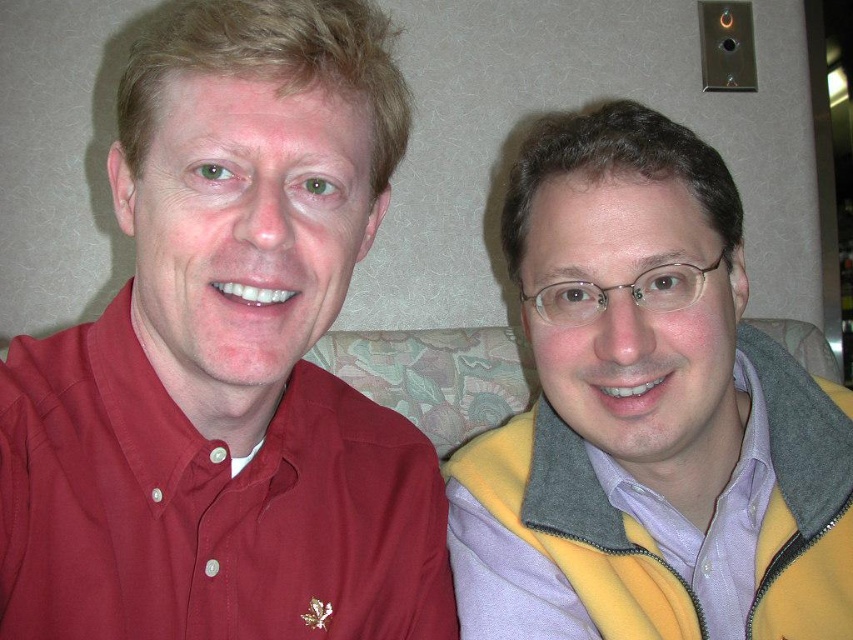
You are designing a new outfit for a character in a video game. The character will be sitting on the floral fabric couch at center while wearing the matte red shirt at left. Based on the size comparison between these two objects, what adjustment might you need to make to ensure the character looks proportional?

The matte red shirt at left has a larger size compared to floral fabric couch at center, so you should scale down the size of the matte red shirt at left to match the proportions of the floral fabric couch at center for a realistic appearance.